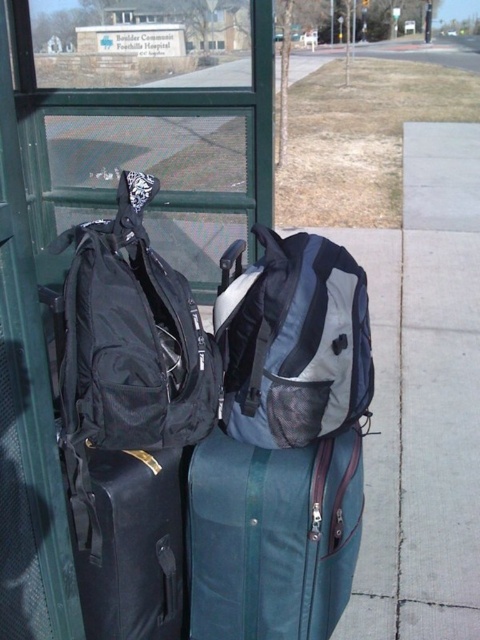
You are a delivery robot with a maximum reach of 1.5 meters. You need to pick up the teal fabric suitcase at center. Can you reach it from your current position?

The teal fabric suitcase at center is 1.42 meters away from the camera, so yes, the delivery robot can reach it since its maximum reach is 1.5 meters, which is greater than the distance.